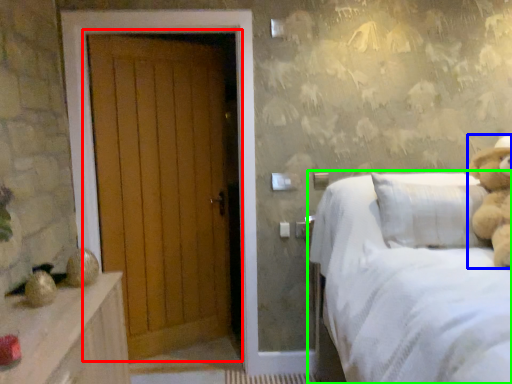
Question: Based on their relative distances, which object is farther from door (highlighted by a red box)? Choose from teddy bear (highlighted by a blue box) and bed (highlighted by a green box).

Choices:
 (A) teddy bear
 (B) bed

Answer: (A)